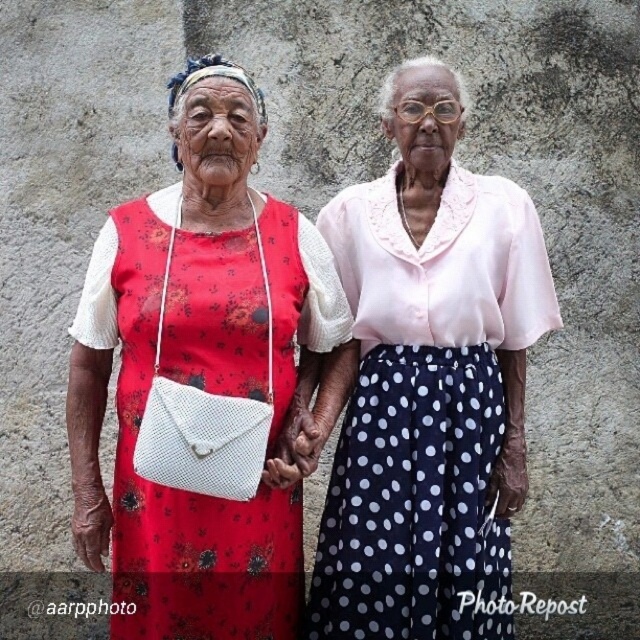
Question: Which of the following is the farthest from the observer?

Choices:
 (A) matte floral dress at center
 (B) dark blue polka dot skirt at center
 (C) red floral fabric dress at left

Answer: (B)

Question: In this image, where is matte floral dress at center located relative to red floral fabric dress at left?

Choices:
 (A) below
 (B) above

Answer: (A)

Question: Can you confirm if matte floral dress at center is smaller than dark blue polka dot skirt at center?

Choices:
 (A) no
 (B) yes

Answer: (B)

Question: Among these points, which one is nearest to the camera?

Choices:
 (A) (429, 449)
 (B) (291, 577)
 (C) (144, 544)

Answer: (C)

Question: Is matte floral dress at center thinner than dark blue polka dot skirt at center?

Choices:
 (A) yes
 (B) no

Answer: (A)

Question: Considering the real-world distances, which object is farthest from the dark blue polka dot skirt at center?

Choices:
 (A) matte floral dress at center
 (B) red floral fabric dress at left

Answer: (A)